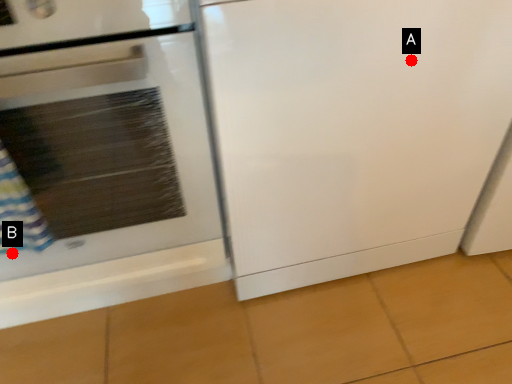
Question: Two points are circled on the image, labeled by A and B beside each circle. Which of the following is the closest to the observer?

Choices:
 (A) A is closer
 (B) B is closer

Answer: (A)